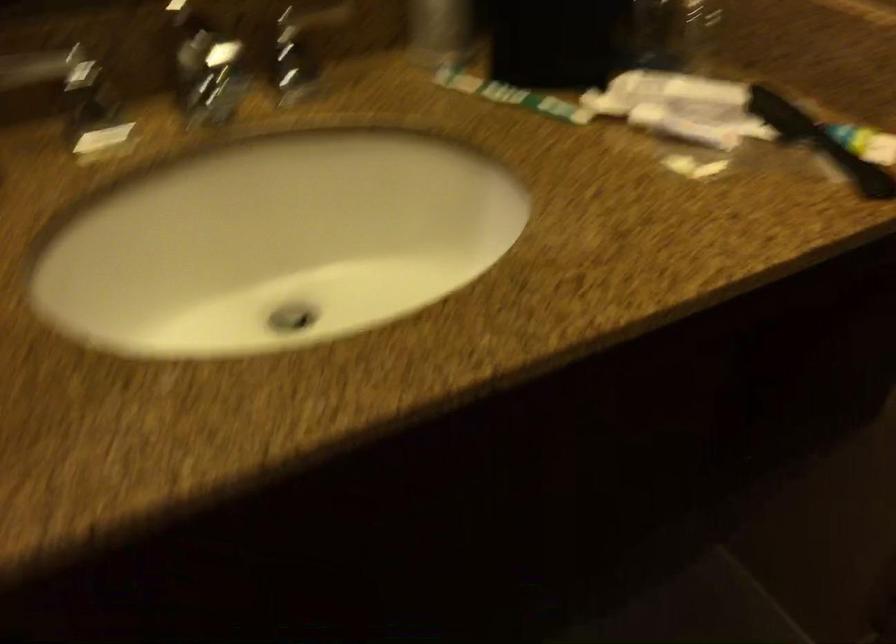
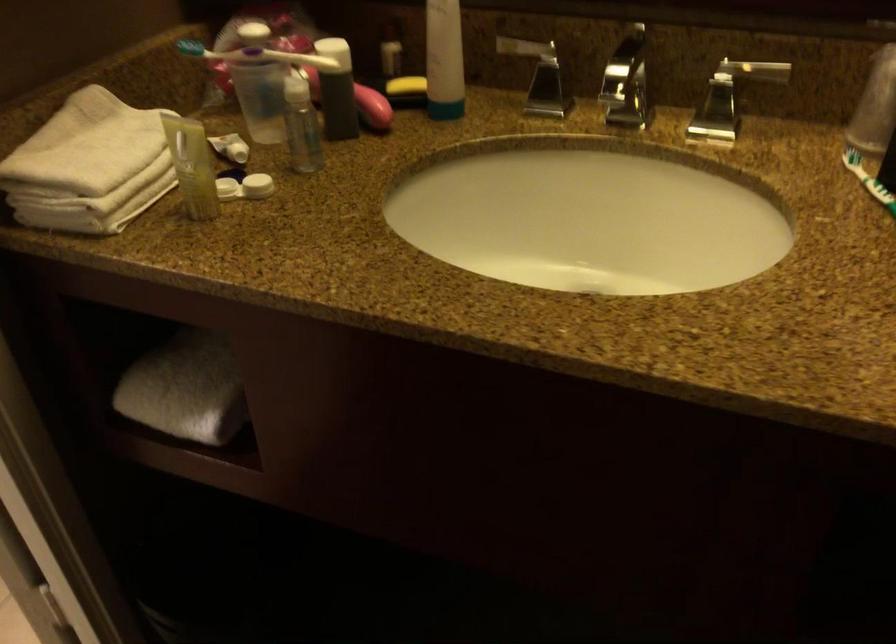
Locate, in the second image, the point that corresponds to pixel 486 80 in the first image.

(867, 180)